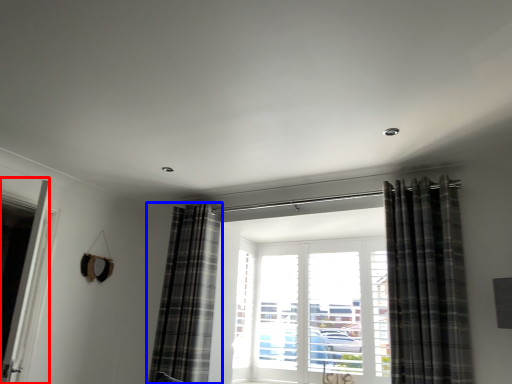
Question: Among these objects, which one is nearest to the camera, screen door (highlighted by a red box) or curtain (highlighted by a blue box)?

Choices:
 (A) screen door
 (B) curtain

Answer: (A)